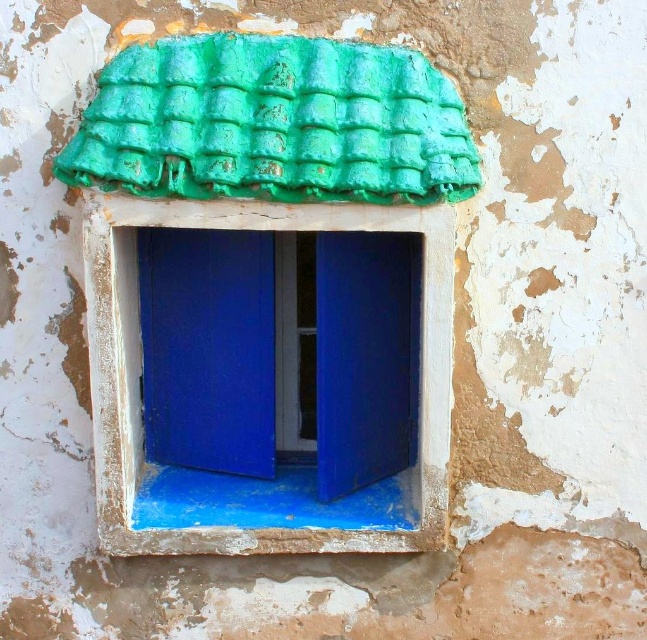
Between green textured tiles at upper center and white painted wood at center, which one appears on the left side from the viewer's perspective?

green textured tiles at upper center

Is point (444, 112) closer to viewer compared to point (85, 198)?

No, it is behind (85, 198).

The height and width of the screenshot is (640, 647). I want to click on green textured tiles at upper center, so click(272, 124).